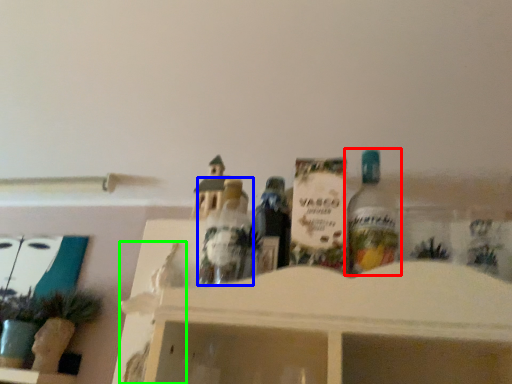
Question: Based on their relative distances, which object is nearer to bottle (highlighted by a red box)? Choose from toy (highlighted by a blue box) and toy (highlighted by a green box).

Choices:
 (A) toy
 (B) toy

Answer: (A)